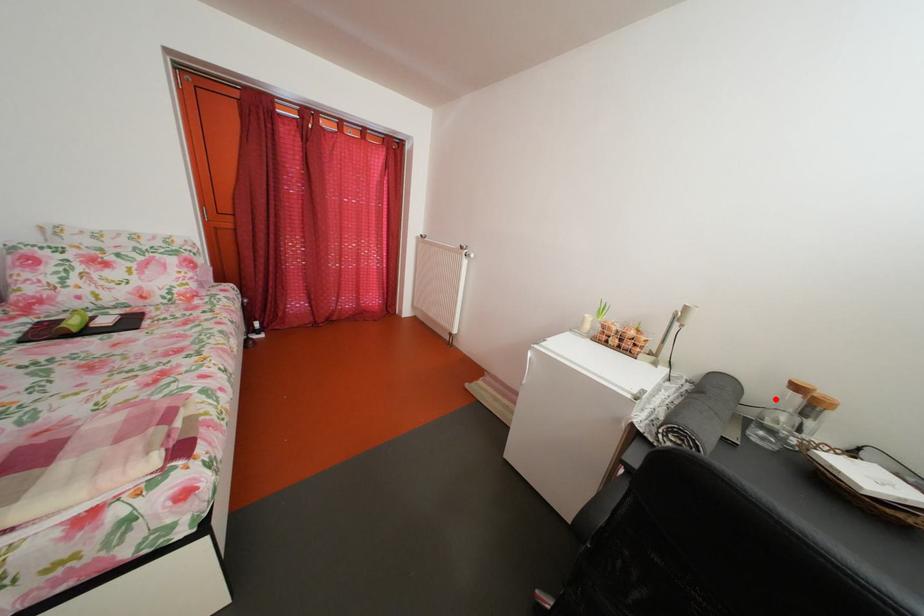
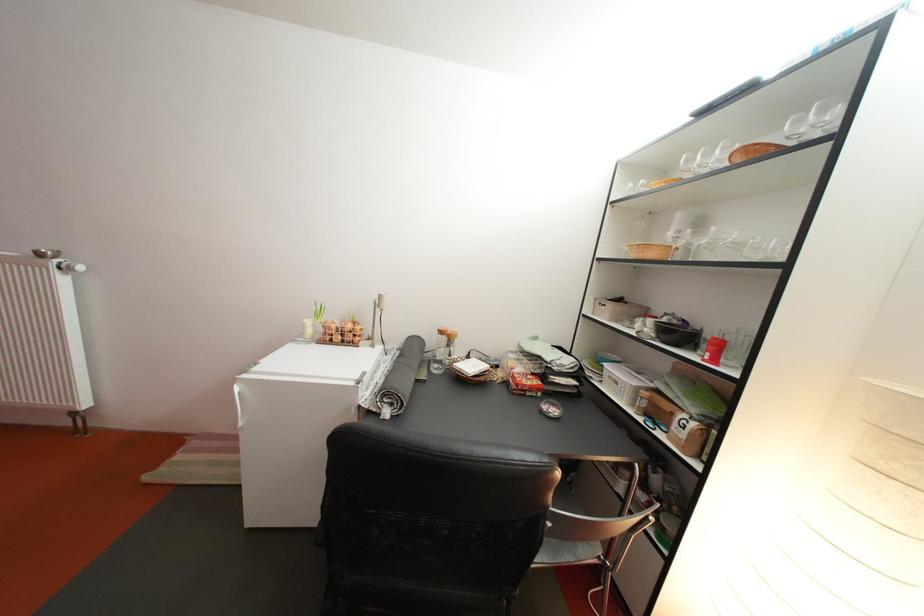
Find the pixel in the second image that matches the highlighted location in the first image.

(444, 346)